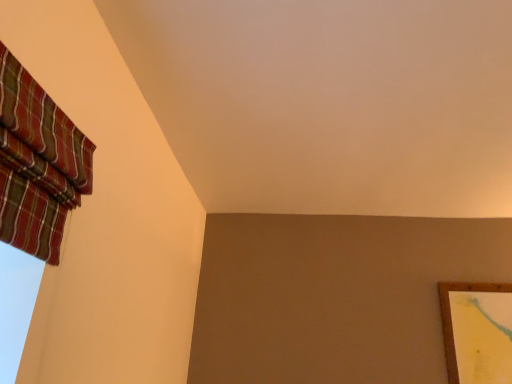
You are a GUI agent. You are given a task and a screenshot of the screen. Output one action in this format:
    pyautogui.click(x=<x>, y=<y>)
    Task: Click on the plaid fabric curtain at left
    Image resolution: width=512 pixels, height=384 pixels.
    Given the screenshot: What is the action you would take?
    pyautogui.click(x=38, y=164)

Measure the distance between plaid fabric curtain at left and camera.

The depth of plaid fabric curtain at left is 37.05 inches.

What do you see at coordinates (38, 164) in the screenshot? I see `plaid fabric curtain at left` at bounding box center [38, 164].

The image size is (512, 384). I want to click on plaid fabric curtain at left, so click(38, 164).